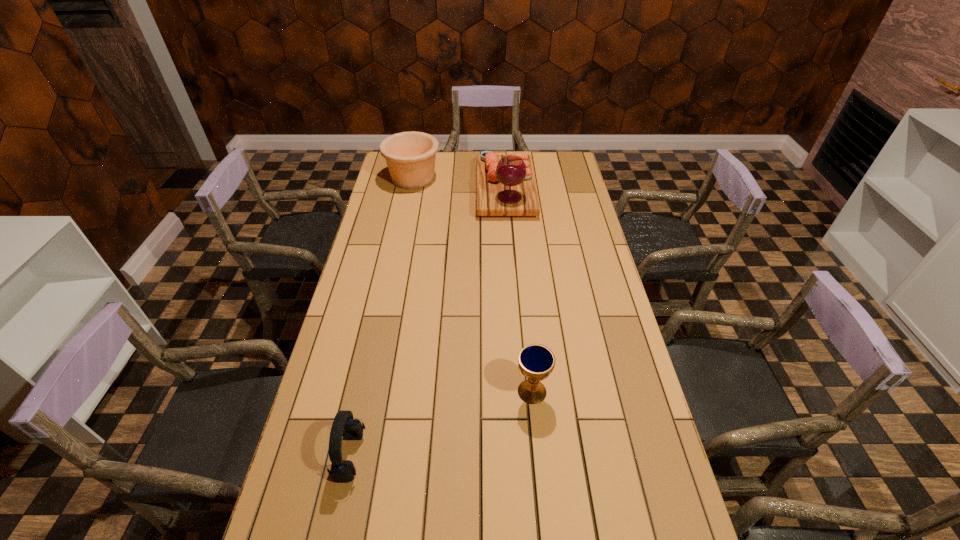
Image resolution: width=960 pixels, height=540 pixels. I want to click on vacant area between the pottery and the tallest object, so coord(459,184).

Locate an element on the screen. free space between the second nearest object and the headset is located at coordinates (442, 423).

Image resolution: width=960 pixels, height=540 pixels. Find the location of `unoccupied area between the chalice and the platter`. unoccupied area between the chalice and the platter is located at coordinates (518, 291).

The image size is (960, 540). In order to click on free point between the pottery and the second nearest object in this screenshot , I will do 472,285.

Identify which object is the nearest to the pottery. Please provide its 2D coordinates. Your answer should be formatted as a tuple, i.e. [(x, y)], where the tuple contains the x and y coordinates of a point satisfying the conditions above.

[(505, 184)]

You are a GUI agent. You are given a task and a screenshot of the screen. Output one action in this format:
    pyautogui.click(x=<x>, y=<y>)
    Task: Click on the object that stands as the second closest to the platter
    
    Given the screenshot: What is the action you would take?
    (536, 362)

Find the location of a particular element. The height and width of the screenshot is (540, 960). vacant space that satisfies the following two spatial constraints: 1. on the front side of the second nearest object; 2. on the left side of the tallest object is located at coordinates (520, 392).